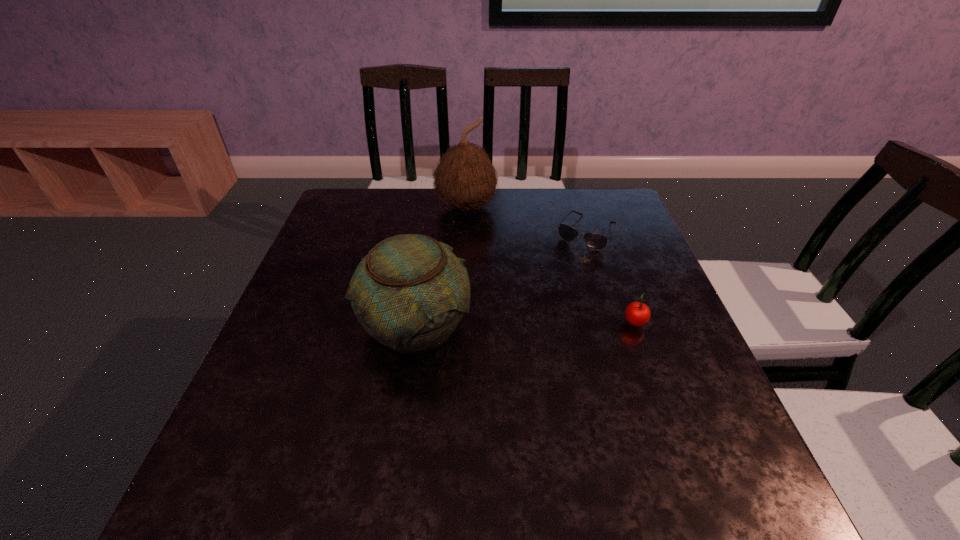
Identify the location of blank space located 0.260m on the surface of the tallest object. (487, 283).

Where is `free space located on the surface of the tallest object`? This screenshot has height=540, width=960. free space located on the surface of the tallest object is located at coordinates (496, 318).

Locate an element on the screen. sunglasses present at the far edge is located at coordinates (595, 241).

Locate an element on the screen. Image resolution: width=960 pixels, height=540 pixels. coconut at the far edge is located at coordinates click(465, 178).

Image resolution: width=960 pixels, height=540 pixels. I want to click on cherry present at the right edge, so click(637, 314).

Locate an element on the screen. The width and height of the screenshot is (960, 540). sunglasses situated at the right edge is located at coordinates (595, 241).

I want to click on object located at the far right corner, so click(x=595, y=241).

Locate an element on the screen. free space at the far edge of the desktop is located at coordinates (427, 230).

Where is `vacant space at the near edge of the desktop`? The width and height of the screenshot is (960, 540). vacant space at the near edge of the desktop is located at coordinates (563, 435).

At what (x,y) coordinates should I click in order to perform the action: click on vacant space at the left edge of the desktop. Please return your answer as a coordinate pair (x, y). Looking at the image, I should click on (268, 368).